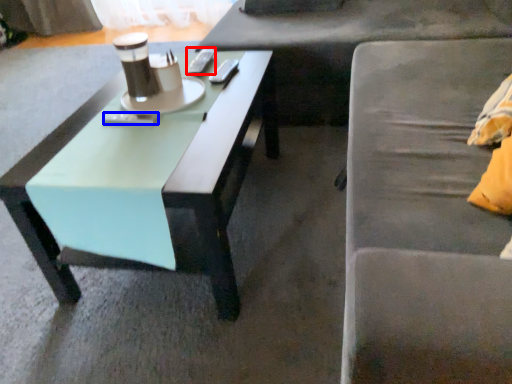
Question: Which point is further to the camera, remote control (highlighted by a red box) or remote control (highlighted by a blue box)?

Choices:
 (A) remote control
 (B) remote control

Answer: (A)